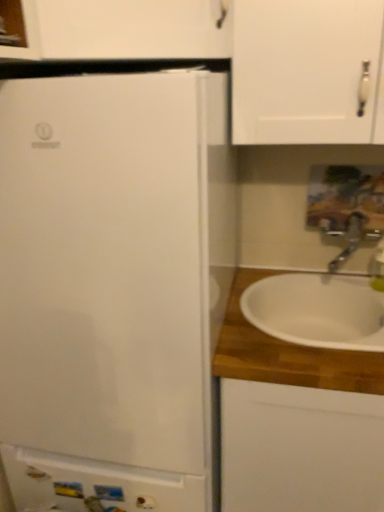
Question: Is white wood cabinet at right, which is the second cabinetry from left to right, taller or shorter than satin nickel faucet at right?

Choices:
 (A) tall
 (B) short

Answer: (A)

Question: From the image's perspective, relative to satin nickel faucet at right, is white wood cabinet at right, positioned as the 1th cabinetry in right-to-left order, above or below?

Choices:
 (A) above
 (B) below

Answer: (B)

Question: Estimate the real-world distances between objects in this image. Which object is closer to the white ceramic sink at right?

Choices:
 (A) white glossy cabinet at lower left, placed as the 2th cabinetry when sorted from right to left
 (B) white wood cabinet at right, positioned as the 1th cabinetry in right-to-left order
 (C) satin nickel faucet at right

Answer: (B)

Question: Which object is the closest to the white ceramic sink at right?

Choices:
 (A) white glossy cabinet at lower left, the first cabinetry from the left
 (B) satin nickel faucet at right
 (C) white wood cabinet at right, which is the second cabinetry from left to right

Answer: (C)